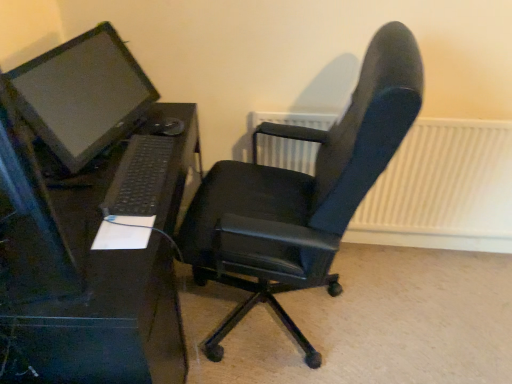
You are a GUI agent. You are given a task and a screenshot of the screen. Output one action in this format:
    pyautogui.click(x=<x>, y=<y>)
    Task: Click on the vacant space underneath white textured radiator at upper right (from a real-world perspective)
    This screenshot has width=512, height=384.
    Given the screenshot: What is the action you would take?
    pyautogui.click(x=411, y=245)